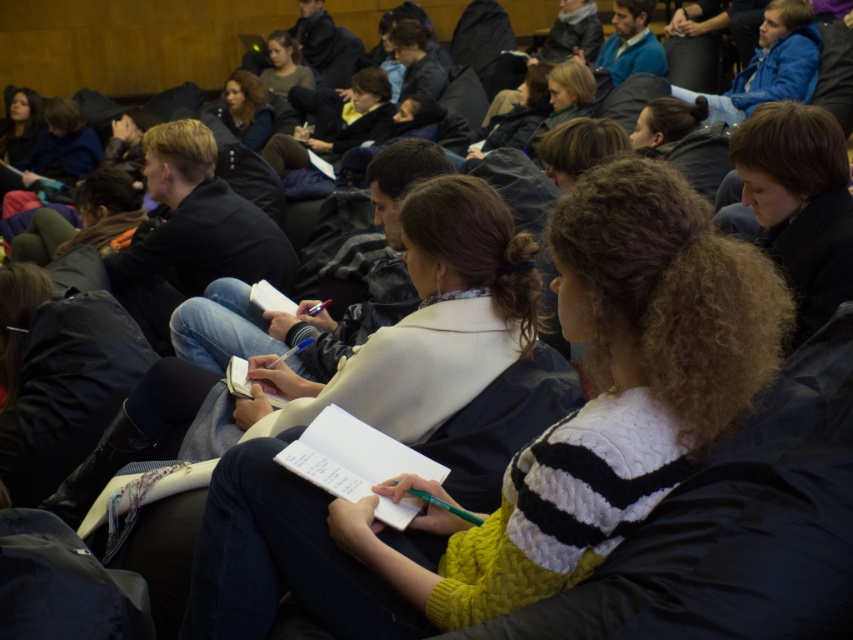
Question: Is black leather jacket at center below blue cotton jacket at upper right?

Choices:
 (A) no
 (B) yes

Answer: (B)

Question: Can you confirm if brown hair at center is positioned below matte black hair at upper left?

Choices:
 (A) yes
 (B) no

Answer: (A)

Question: Which object is farther from the camera taking this photo?

Choices:
 (A) blue knit sweater at upper right
 (B) brown hair at center
 (C) matte black jacket at upper center

Answer: (C)

Question: Which of the following is the closest to the observer?

Choices:
 (A) (619, 81)
 (B) (329, 456)

Answer: (B)

Question: Is white paper at center bigger than blue knit sweater at upper right?

Choices:
 (A) yes
 (B) no

Answer: (B)

Question: Among these points, which one is nearest to the camera?

Choices:
 (A) (184, 129)
 (B) (573, 582)
 (C) (749, 60)

Answer: (B)